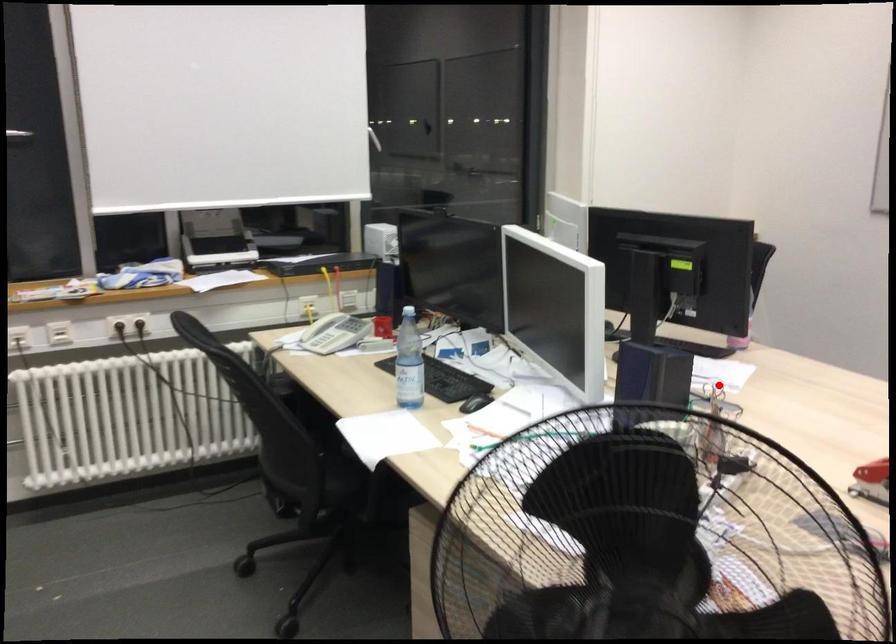
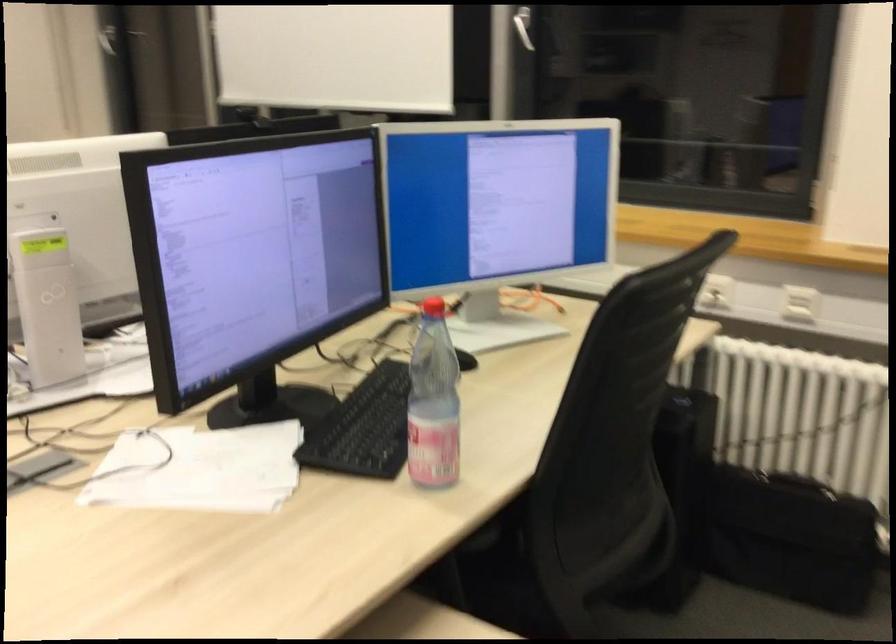
Find the pixel in the second image that matches the highlighted location in the first image.

(199, 469)